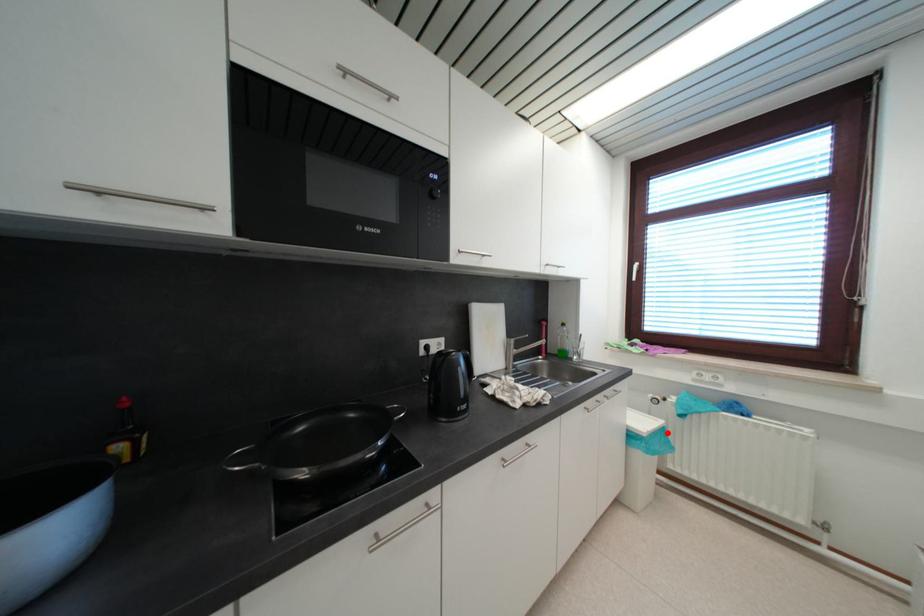
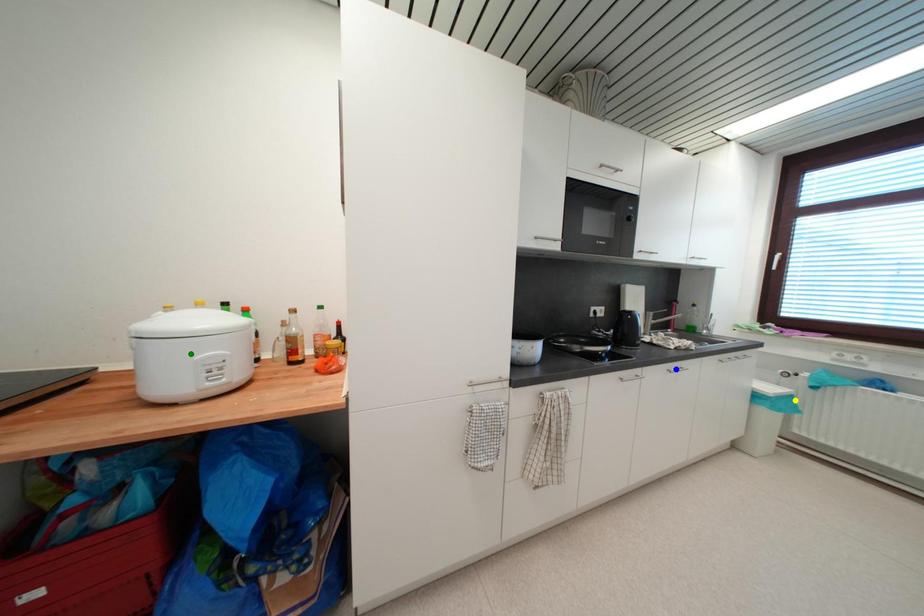
Question: I am providing you with two images of the same scene from different viewpoints. A red point is marked on the first image. You are given multiple points on the second image. Which point in image 2 represents the same 3d spot as the red point in image 1?

Choices:
 (A) green point
 (B) yellow point
 (C) blue point

Answer: (B)